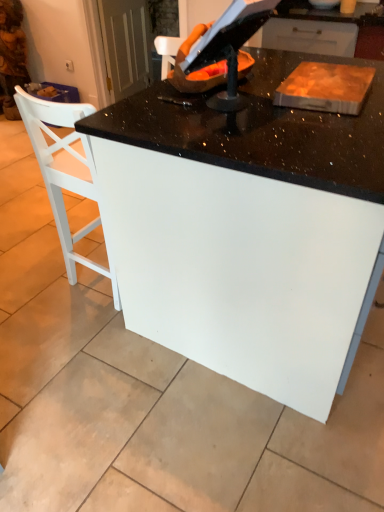
Image resolution: width=384 pixels, height=512 pixels. Describe the element at coordinates (247, 229) in the screenshot. I see `white glossy table at center` at that location.

What is the approximate height of white glossy table at center?

It is 35.98 inches.

Locate an element on the screen. This screenshot has height=512, width=384. white glossy table at center is located at coordinates (247, 229).

What do you see at coordinates (65, 173) in the screenshot?
I see `white wooden chair at left` at bounding box center [65, 173].

Where is `white wooden chair at left`? The height and width of the screenshot is (512, 384). white wooden chair at left is located at coordinates (65, 173).

The height and width of the screenshot is (512, 384). Find the location of `white glossy table at center`. white glossy table at center is located at coordinates (247, 229).

Is white wooden chair at left at the right side of white glossy table at center?

No, white wooden chair at left is not to the right of white glossy table at center.

In the image, is white wooden chair at left positioned in front of or behind white glossy table at center?

white wooden chair at left is positioned farther from the viewer than white glossy table at center.

Is point (72, 236) closer or farther from the camera than point (211, 118)?

Point (72, 236) is farther from the camera than point (211, 118).

From the image's perspective, is white wooden chair at left under white glossy table at center?

Incorrect, from the image's perspective, white wooden chair at left is higher than white glossy table at center.

From a real-world perspective, does white wooden chair at left stand above white glossy table at center?

Yes, from a real-world perspective, white wooden chair at left is on top of white glossy table at center.

Does white wooden chair at left have a lesser width compared to white glossy table at center?

Yes, white wooden chair at left is thinner than white glossy table at center.

From their relative heights in the image, would you say white wooden chair at left is taller or shorter than white glossy table at center?

Considering their sizes, white wooden chair at left has more height than white glossy table at center.

Considering the sizes of objects white wooden chair at left and white glossy table at center in the image provided, who is smaller, white wooden chair at left or white glossy table at center?

Smaller between the two is white wooden chair at left.

Is white glossy table at center completely or partially inside white wooden chair at left?

Definitely not — white glossy table at center is not inside white wooden chair at left.

Looking at this image, is white wooden chair at left with white glossy table at center?

white wooden chair at left and white glossy table at center are not in contact.

Is white wooden chair at left aimed at white glossy table at center?

No, white wooden chair at left is not oriented towards white glossy table at center.

Can you tell me how much white wooden chair at left and white glossy table at center differ in facing direction?

There is a 89.8-degree angle between the facing directions of white wooden chair at left and white glossy table at center.

From the picture: How much distance is there between white wooden chair at left and white glossy table at center?

white wooden chair at left is 16.65 inches away from white glossy table at center.

At what (x,y) coordinates should I click in order to perform the action: click on chair that is above the white glossy table at center (from the image's perspective). Please return your answer as a coordinate pair (x, y). Looking at the image, I should click on (65, 173).

Which object is positioned more to the left, white glossy table at center or white wooden chair at left?

white wooden chair at left.

Is white glossy table at center further to the viewer compared to white wooden chair at left?

No, it is in front of white wooden chair at left.

Which point is more distant from viewer, (224, 304) or (32, 97)?

The point (32, 97) is farther.

From the image's perspective, which object appears higher, white glossy table at center or white wooden chair at left?

white wooden chair at left is shown above in the image.

From a real-world perspective, which is physically below, white glossy table at center or white wooden chair at left?

white glossy table at center is physically lower.

Is white glossy table at center wider than white wooden chair at left?

Yes.

Can you confirm if white glossy table at center is taller than white wooden chair at left?

In fact, white glossy table at center may be shorter than white wooden chair at left.

Can you confirm if white glossy table at center is bigger than white wooden chair at left?

Indeed, white glossy table at center has a larger size compared to white wooden chair at left.

Is white glossy table at center spatially inside white wooden chair at left, or outside of it?

white glossy table at center is located beyond the bounds of white wooden chair at left.

Does white glossy table at center touch white wooden chair at left?

There is a gap between white glossy table at center and white wooden chair at left.

In the scene shown: Could you tell me if white glossy table at center is facing white wooden chair at left?

Yes, white glossy table at center is facing white wooden chair at left.

How many degrees apart are the facing directions of white glossy table at center and white wooden chair at left?

The facing directions of white glossy table at center and white wooden chair at left are 89.8 degrees apart.

Image resolution: width=384 pixels, height=512 pixels. Identify the location of table that is on the right side of white wooden chair at left. (247, 229).

Image resolution: width=384 pixels, height=512 pixels. What are the coordinates of `table on the right side of white wooden chair at left` in the screenshot? It's located at (247, 229).

At what (x,y) coordinates should I click in order to perform the action: click on chair behind the white glossy table at center. Please return your answer as a coordinate pair (x, y). This screenshot has height=512, width=384. Looking at the image, I should click on (65, 173).